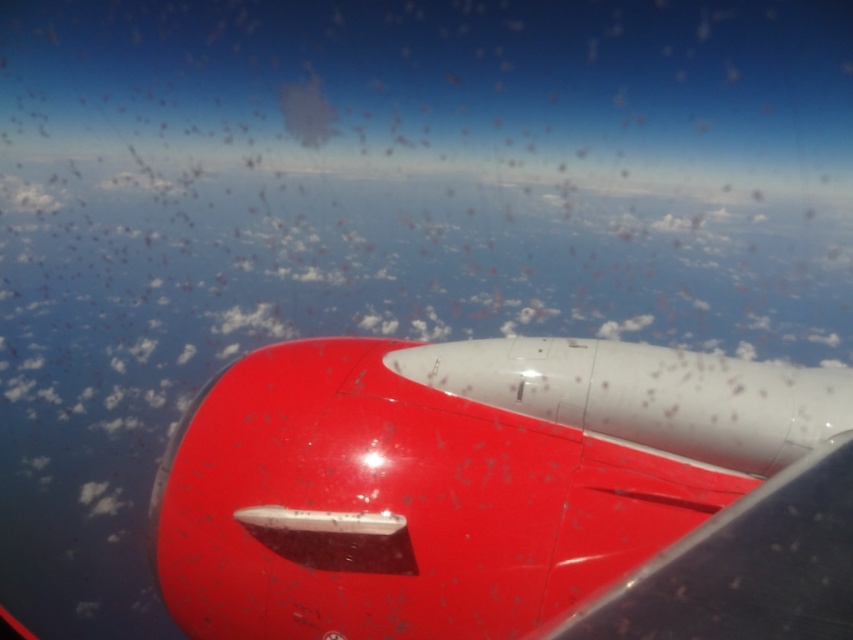
Question: Observing the image, what is the correct spatial positioning of glossy red airplane wing at center in reference to glossy red wing at center?

Choices:
 (A) left
 (B) right

Answer: (A)

Question: Is glossy red airplane wing at center above glossy red wing at center?

Choices:
 (A) no
 (B) yes

Answer: (B)

Question: Can you confirm if glossy red airplane wing at center is positioned to the right of glossy red wing at center?

Choices:
 (A) no
 (B) yes

Answer: (A)

Question: Which point is farther from the camera taking this photo?

Choices:
 (A) (755, 612)
 (B) (486, 538)

Answer: (B)

Question: Which point is closer to the camera taking this photo?

Choices:
 (A) (793, 513)
 (B) (171, 566)

Answer: (A)